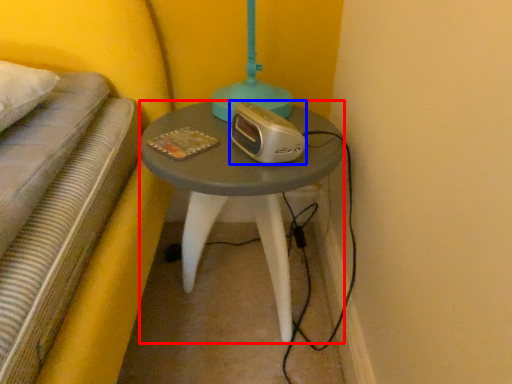
Question: Which point is closer to the camera, table (highlighted by a red box) or appliance (highlighted by a blue box)?

Choices:
 (A) table
 (B) appliance

Answer: (B)